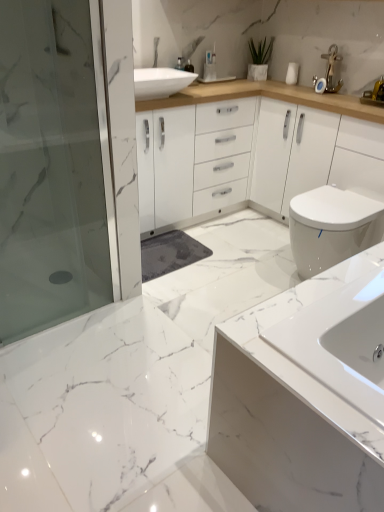
Question: Considering the relative sizes of white glossy sink at lower right and transparent glass shower door at left in the image provided, is white glossy sink at lower right taller than transparent glass shower door at left?

Choices:
 (A) no
 (B) yes

Answer: (A)

Question: Is white glossy sink at lower right not near transparent glass shower door at left?

Choices:
 (A) yes
 (B) no

Answer: (A)

Question: Does white glossy sink at lower right come in front of transparent glass shower door at left?

Choices:
 (A) no
 (B) yes

Answer: (B)

Question: Is white glossy sink at lower right surrounding transparent glass shower door at left?

Choices:
 (A) yes
 (B) no

Answer: (B)

Question: Is white glossy sink at lower right facing towards transparent glass shower door at left?

Choices:
 (A) yes
 (B) no

Answer: (A)

Question: Considering the positions of green matte plant at upper center and white glossy sink at lower right in the image, is green matte plant at upper center wider or thinner than white glossy sink at lower right?

Choices:
 (A) thin
 (B) wide

Answer: (A)

Question: Considering their positions, is green matte plant at upper center located in front of or behind white glossy sink at lower right?

Choices:
 (A) front
 (B) behind

Answer: (B)

Question: Is green matte plant at upper center inside or outside of white glossy sink at lower right?

Choices:
 (A) outside
 (B) inside

Answer: (A)

Question: From their relative heights in the image, would you say green matte plant at upper center is taller or shorter than white glossy sink at lower right?

Choices:
 (A) short
 (B) tall

Answer: (A)

Question: From a real-world perspective, is white glossy sink at lower right above or below green matte plant at upper center?

Choices:
 (A) below
 (B) above

Answer: (A)

Question: In terms of height, does white glossy sink at lower right look taller or shorter compared to green matte plant at upper center?

Choices:
 (A) short
 (B) tall

Answer: (B)

Question: Considering their positions, is white glossy sink at lower right located in front of or behind green matte plant at upper center?

Choices:
 (A) behind
 (B) front

Answer: (B)

Question: From the image's perspective, is white glossy sink at lower right above or below green matte plant at upper center?

Choices:
 (A) below
 (B) above

Answer: (A)

Question: Considering the positions of point (334, 219) and point (231, 324), is point (334, 219) closer or farther from the camera than point (231, 324)?

Choices:
 (A) farther
 (B) closer

Answer: (A)

Question: Is white glossy toilet at right in front of or behind white glossy sink at lower right in the image?

Choices:
 (A) behind
 (B) front

Answer: (A)